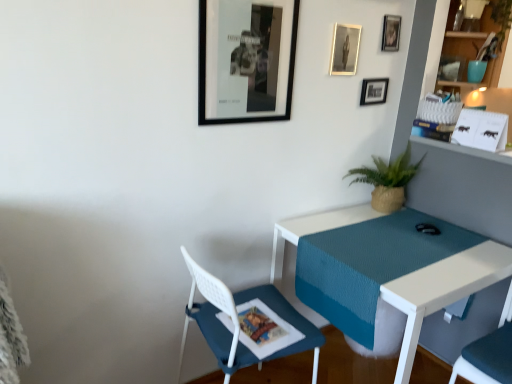
The image size is (512, 384). Find the location of `green woven pot at right`. green woven pot at right is located at coordinates (387, 180).

Image resolution: width=512 pixels, height=384 pixels. What do you see at coordinates (464, 42) in the screenshot? I see `teal fabric shelf at upper right` at bounding box center [464, 42].

What is the approximate height of metallic silver picture frame at upper center, the 4th picture frame when ordered from front to back?

5.28 inches.

Where is `metallic silver picture frame at upper center, which ranks as the first picture frame in back-to-front order`? Image resolution: width=512 pixels, height=384 pixels. metallic silver picture frame at upper center, which ranks as the first picture frame in back-to-front order is located at coordinates (374, 91).

The height and width of the screenshot is (384, 512). Identify the location of metallic silver picture frame at upper right, placed as the 1th picture frame when sorted from right to left. (391, 33).

Describe the element at coordinates (391, 33) in the screenshot. I see `metallic silver picture frame at upper right, placed as the 1th picture frame when sorted from right to left` at that location.

What are the coordinates of `green woven pot at right` in the screenshot? It's located at (387, 180).

Is teal ceramic vase at upper right wider than white textured desk at center?

No, teal ceramic vase at upper right is not wider than white textured desk at center.

Is teal ceramic vase at upper right beside white textured desk at center?

No, teal ceramic vase at upper right is not touching white textured desk at center.

Considering the positions of points (486, 63) and (409, 324), is point (486, 63) farther from camera compared to point (409, 324)?

That is True.

You are a GUI agent. You are given a task and a screenshot of the screen. Output one action in this format:
    pyautogui.click(x=<x>, y=<y>)
    Task: Click on the teal behind the white textured desk at center
    This screenshot has width=512, height=384.
    Given the screenshot: What is the action you would take?
    pyautogui.click(x=476, y=70)

Is metallic silver picture frame at upper center, marked as the second picture frame in a right-to-left arrangement, at the back of black matte picture frame at upper center, the first picture frame when ordered from front to back?

No, black matte picture frame at upper center, the first picture frame when ordered from front to back, is not facing away from metallic silver picture frame at upper center, marked as the second picture frame in a right-to-left arrangement.

Is black matte picture frame at upper center, the first picture frame when ordered from front to back, not within metallic silver picture frame at upper center, which ranks as the first picture frame in back-to-front order?

Absolutely, black matte picture frame at upper center, the first picture frame when ordered from front to back, is external to metallic silver picture frame at upper center, which ranks as the first picture frame in back-to-front order.

Is the depth of black matte picture frame at upper center, which is counted as the fourth picture frame, starting from the back, less than that of metallic silver picture frame at upper center, which ranks as the first picture frame in back-to-front order?

Yes, black matte picture frame at upper center, which is counted as the fourth picture frame, starting from the back, is closer to the camera.

Would you say black matte picture frame at upper center, which is the 4th picture frame in right-to-left order, is to the left or to the right of metallic silver picture frame at upper center, marked as the second picture frame in a right-to-left arrangement, in the picture?

From the image, it's evident that black matte picture frame at upper center, which is the 4th picture frame in right-to-left order, is to the left of metallic silver picture frame at upper center, marked as the second picture frame in a right-to-left arrangement.

Does fabric cushioned chair at lower right, the first chair from the right, appear on the right side of metallic silver photo frame at upper center, which appears as the 3th picture frame when viewed from the right?

Correct, you'll find fabric cushioned chair at lower right, the first chair from the right, to the right of metallic silver photo frame at upper center, which appears as the 3th picture frame when viewed from the right.

Is the position of fabric cushioned chair at lower right, the first chair from the right, more distant than that of metallic silver photo frame at upper center, which appears as the 3th picture frame when viewed from the right?

That is False.

Could metallic silver photo frame at upper center, acting as the 3th picture frame starting from the back, be considered to be inside fabric cushioned chair at lower right, positioned as the 2th chair in left-to-right order?

Actually, metallic silver photo frame at upper center, acting as the 3th picture frame starting from the back, is outside fabric cushioned chair at lower right, positioned as the 2th chair in left-to-right order.

From a real-world perspective, is fabric cushioned chair at lower right, the first chair from the right, positioned under metallic silver photo frame at upper center, marked as the second picture frame in a left-to-right arrangement, based on gravity?

Correct, in the physical world, fabric cushioned chair at lower right, the first chair from the right, is lower than metallic silver photo frame at upper center, marked as the second picture frame in a left-to-right arrangement.

Are metallic silver picture frame at upper right, positioned as the 3th picture frame in front-to-back order, and green woven pot at right located far from each other?

They are positioned close to each other.

Is metallic silver picture frame at upper right, the fourth picture frame viewed from the left, at the right side of green woven pot at right?

Incorrect, metallic silver picture frame at upper right, the fourth picture frame viewed from the left, is not on the right side of green woven pot at right.

Is metallic silver picture frame at upper right, the fourth picture frame viewed from the left, situated inside green woven pot at right or outside?

metallic silver picture frame at upper right, the fourth picture frame viewed from the left, is not enclosed by green woven pot at right.

From the picture: Can you tell me how much metallic silver picture frame at upper right, the second picture frame when ordered from back to front, and green woven pot at right differ in facing direction?

The facing directions of metallic silver picture frame at upper right, the second picture frame when ordered from back to front, and green woven pot at right are 1.02 degrees apart.

Which is closer to the camera, (x=477, y=73) or (x=336, y=39)?

Point (x=477, y=73) is farther from the camera than point (x=336, y=39).

Is teal ceramic vase at upper right not inside metallic silver photo frame at upper center, marked as the second picture frame in a left-to-right arrangement?

teal ceramic vase at upper right lies outside metallic silver photo frame at upper center, marked as the second picture frame in a left-to-right arrangement,'s area.

From a real-world perspective, which object rests below the other?

teal ceramic vase at upper right, from a real-world perspective.

Which object is wider, teal ceramic vase at upper right or metallic silver photo frame at upper center, which ranks as the second picture frame in front-to-back order?

teal ceramic vase at upper right is wider.

Is metallic silver picture frame at upper right, the fourth picture frame viewed from the left, facing towards white textured desk at center?

No, metallic silver picture frame at upper right, the fourth picture frame viewed from the left, is not oriented towards white textured desk at center.

From the image's perspective, does metallic silver picture frame at upper right, the fourth picture frame viewed from the left, appear higher than white textured desk at center?

Yes, from the image's perspective, metallic silver picture frame at upper right, the fourth picture frame viewed from the left, is above white textured desk at center.

Is metallic silver picture frame at upper right, placed as the 1th picture frame when sorted from right to left, inside the boundaries of white textured desk at center, or outside?

metallic silver picture frame at upper right, placed as the 1th picture frame when sorted from right to left, cannot be found inside white textured desk at center.

Between metallic silver picture frame at upper right, placed as the 1th picture frame when sorted from right to left, and white textured desk at center, which one has more height?

white textured desk at center is taller.

Measure the distance from white textured desk at center to black matte picture frame at upper center, the first picture frame when ordered from front to back.

white textured desk at center and black matte picture frame at upper center, the first picture frame when ordered from front to back, are 30.73 inches apart from each other.

Is white textured desk at center wider or thinner than black matte picture frame at upper center, the first picture frame when ordered from front to back?

Considering their sizes, white textured desk at center looks broader than black matte picture frame at upper center, the first picture frame when ordered from front to back.

From the image's perspective, which object appears higher, white textured desk at center or black matte picture frame at upper center, which is counted as the fourth picture frame, starting from the back?

black matte picture frame at upper center, which is counted as the fourth picture frame, starting from the back.

Does white textured desk at center appear on the left side of black matte picture frame at upper center, which is the 4th picture frame in right-to-left order?

No, white textured desk at center is not to the left of black matte picture frame at upper center, which is the 4th picture frame in right-to-left order.

The width and height of the screenshot is (512, 384). I want to click on desk that is in front of the teal ceramic vase at upper right, so click(442, 289).

Identify the location of picture frame that is the 1st one above the metallic silver picture frame at upper center, the 4th picture frame when ordered from front to back (from a real-world perspective). This screenshot has height=384, width=512. (246, 60).

Considering their positions, is white textured desk at center positioned further to teal fabric shelf at upper right than metallic silver picture frame at upper center, which ranks as the first picture frame in back-to-front order?

white textured desk at center lies further to teal fabric shelf at upper right than the other object.

When comparing their distances from metallic silver photo frame at upper center, acting as the 3th picture frame starting from the back, does teal ceramic vase at upper right or teal fabric shelf at upper right seem closer?

The object closer to metallic silver photo frame at upper center, acting as the 3th picture frame starting from the back, is teal fabric shelf at upper right.

Based on their spatial positions, is metallic silver photo frame at upper center, marked as the second picture frame in a left-to-right arrangement, or black matte picture frame at upper center, which is counted as the fourth picture frame, starting from the back, further from fabric cushioned chair at lower right, positioned as the 2th chair in left-to-right order?

black matte picture frame at upper center, which is counted as the fourth picture frame, starting from the back.

Considering their positions, is black matte picture frame at upper center, which is the 4th picture frame in right-to-left order, positioned closer to metallic silver picture frame at upper right, placed as the 1th picture frame when sorted from right to left, than metallic silver photo frame at upper center, which ranks as the second picture frame in front-to-back order?

Among the two, metallic silver photo frame at upper center, which ranks as the second picture frame in front-to-back order, is located nearer to metallic silver picture frame at upper right, placed as the 1th picture frame when sorted from right to left.

From the image, which object appears to be nearer to teal fabric shelf at upper right, white mesh chair at lower left, arranged as the 1th chair when viewed from the left, or black matte picture frame at upper center, which is the 4th picture frame in right-to-left order?

black matte picture frame at upper center, which is the 4th picture frame in right-to-left order.

Based on the photo, estimate the real-world distances between objects in this image. Which object is further from metallic silver picture frame at upper right, the second picture frame when ordered from back to front, white textured desk at center or teal ceramic vase at upper right?

Based on the image, white textured desk at center appears to be further to metallic silver picture frame at upper right, the second picture frame when ordered from back to front.

Based on their spatial positions, is green woven pot at right or white textured desk at center further from teal fabric shelf at upper right?

white textured desk at center lies further to teal fabric shelf at upper right than the other object.

When comparing their distances from white textured desk at center, does fabric cushioned chair at lower right, the first chair from the right, or green woven pot at right seem further?

fabric cushioned chair at lower right, the first chair from the right, is positioned further to the anchor white textured desk at center.

This screenshot has width=512, height=384. Find the location of `teal between metallic silver picture frame at upper right, the second picture frame when ordered from back to front, and white textured desk at center, in the vertical direction`. teal between metallic silver picture frame at upper right, the second picture frame when ordered from back to front, and white textured desk at center, in the vertical direction is located at coordinates (476, 70).

Locate an element on the screen. The image size is (512, 384). houseplant that lies between metallic silver picture frame at upper center, marked as the second picture frame in a right-to-left arrangement, and white textured desk at center from top to bottom is located at coordinates (387, 180).

Where is `teal between metallic silver picture frame at upper right, the fourth picture frame viewed from the left, and white mesh chair at lower left, arranged as the 1th chair when viewed from the left, vertically`? The width and height of the screenshot is (512, 384). teal between metallic silver picture frame at upper right, the fourth picture frame viewed from the left, and white mesh chair at lower left, arranged as the 1th chair when viewed from the left, vertically is located at coordinates (476, 70).

Locate an element on the screen. This screenshot has height=384, width=512. desk that lies between metallic silver picture frame at upper right, the second picture frame when ordered from back to front, and white mesh chair at lower left, arranged as the 1th chair when viewed from the left, from top to bottom is located at coordinates (442, 289).